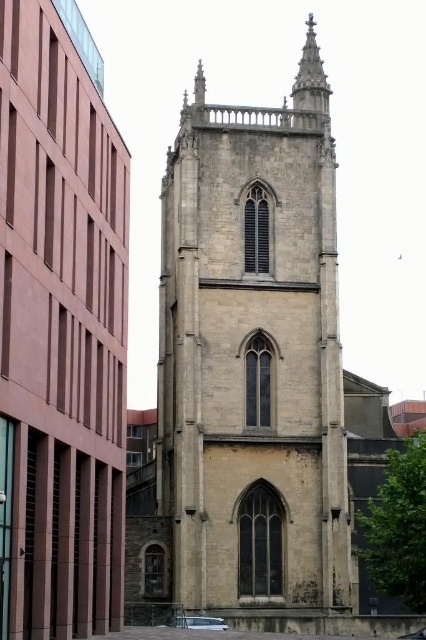
Does beige stone tower at center have a smaller size compared to stone spire at upper center?

No.

Does beige stone tower at center appear over stone spire at upper center?

Actually, beige stone tower at center is below stone spire at upper center.

Is point (210, 289) positioned after point (311, 108)?

No, (210, 289) is closer to viewer.

Where is `beige stone tower at center`? beige stone tower at center is located at coordinates (252, 362).

Can you confirm if beige stone church at center is positioned above stone spire at upper center?

Actually, beige stone church at center is below stone spire at upper center.

From the picture: Is beige stone church at center closer to camera compared to stone spire at upper center?

Yes.

What do you see at coordinates (60, 330) in the screenshot?
I see `beige stone church at center` at bounding box center [60, 330].

You are a GUI agent. You are given a task and a screenshot of the screen. Output one action in this format:
    pyautogui.click(x=<x>, y=<y>)
    Task: Click on the beige stone church at center
    The width and height of the screenshot is (426, 640).
    Given the screenshot: What is the action you would take?
    pyautogui.click(x=60, y=330)

Looking at this image, is beige stone tower at center below beige stone church at center?

Correct, beige stone tower at center is located below beige stone church at center.

Measure the distance from beige stone tower at center to beige stone church at center.

The distance of beige stone tower at center from beige stone church at center is 11.26 meters.

Which is behind, point (267, 449) or point (88, 64)?

The point (88, 64) is behind.

Locate an element on the screen. beige stone tower at center is located at coordinates (252, 362).